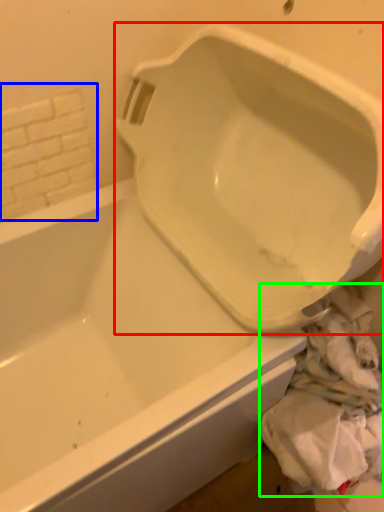
Question: Which object is positioned closest to urinal (highlighted by a red box)? Select from tile (highlighted by a blue box) and material (highlighted by a green box).

Choices:
 (A) tile
 (B) material

Answer: (B)